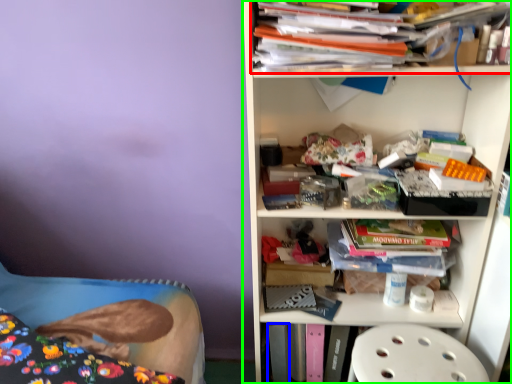
Question: Estimate the real-world distances between objects in this image. Which object is farther from book (highlighted by a red box), paperback book (highlighted by a blue box) or shelf (highlighted by a green box)?

Choices:
 (A) paperback book
 (B) shelf

Answer: (A)